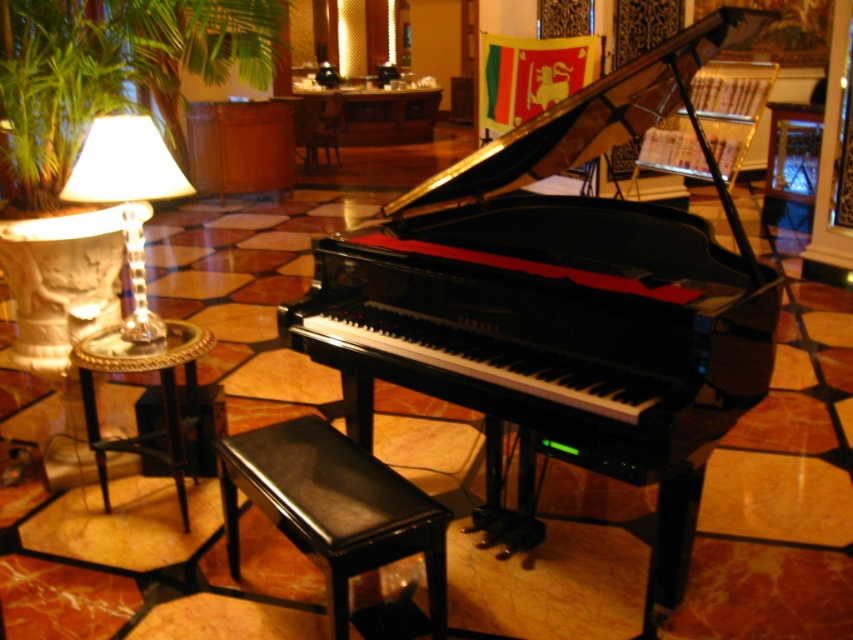
From the picture: Between black polished piano at center and metallic gold side table at left, which one is positioned higher?

black polished piano at center is higher up.

Who is positioned more to the right, black polished piano at center or metallic gold side table at left?

Positioned to the right is black polished piano at center.

This screenshot has width=853, height=640. Describe the element at coordinates (561, 305) in the screenshot. I see `black polished piano at center` at that location.

At what (x,y) coordinates should I click in order to perform the action: click on black polished piano at center. Please return your answer as a coordinate pair (x, y). Looking at the image, I should click on (561, 305).

Is black polished piano at center wider than wooden chair at center?

Yes.

Which is in front, point (338, 332) or point (302, 141)?

Positioned in front is point (338, 332).

Image resolution: width=853 pixels, height=640 pixels. What are the coordinates of `black polished piano at center` in the screenshot? It's located at (561, 305).

Locate an element on the screen. black polished piano at center is located at coordinates (561, 305).

Between black polished piano at center and green leafy plant at left, which one has less height?

black polished piano at center is shorter.

Is black polished piano at center wider than green leafy plant at left?

In fact, black polished piano at center might be narrower than green leafy plant at left.

Where is `black polished piano at center`? black polished piano at center is located at coordinates (561, 305).

You are a GUI agent. You are given a task and a screenshot of the screen. Output one action in this format:
    pyautogui.click(x=<x>, y=<y>)
    Task: Click on the black polished piano at center
    
    Given the screenshot: What is the action you would take?
    pyautogui.click(x=561, y=305)